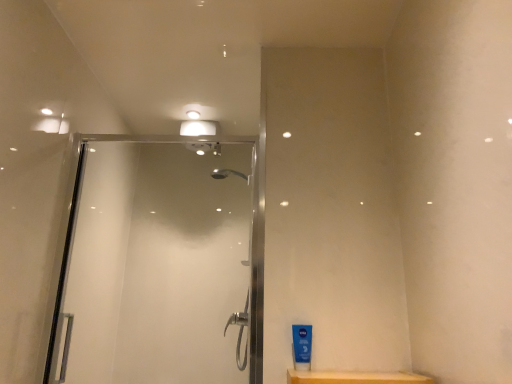
Question: Does clear glass shower door at center lie in front of blue plastic tube at lower right?

Choices:
 (A) yes
 (B) no

Answer: (B)

Question: Is clear glass shower door at center outside of blue plastic tube at lower right?

Choices:
 (A) yes
 (B) no

Answer: (A)

Question: Is clear glass shower door at center taller than blue plastic tube at lower right?

Choices:
 (A) no
 (B) yes

Answer: (B)

Question: Is clear glass shower door at center far from blue plastic tube at lower right?

Choices:
 (A) yes
 (B) no

Answer: (A)

Question: Is clear glass shower door at center facing away from blue plastic tube at lower right?

Choices:
 (A) no
 (B) yes

Answer: (A)

Question: Is the surface of clear glass shower door at center in direct contact with blue plastic tube at lower right?

Choices:
 (A) yes
 (B) no

Answer: (B)

Question: Would you say blue plastic tube at lower right is outside clear glass shower door at center?

Choices:
 (A) no
 (B) yes

Answer: (B)

Question: Can you confirm if blue plastic tube at lower right is taller than clear glass shower door at center?

Choices:
 (A) yes
 (B) no

Answer: (B)

Question: From the image's perspective, is blue plastic tube at lower right below clear glass shower door at center?

Choices:
 (A) no
 (B) yes

Answer: (B)

Question: Does blue plastic tube at lower right have a lesser width compared to clear glass shower door at center?

Choices:
 (A) yes
 (B) no

Answer: (A)

Question: Is blue plastic tube at lower right smaller than clear glass shower door at center?

Choices:
 (A) no
 (B) yes

Answer: (B)

Question: Could you tell me if blue plastic tube at lower right is facing clear glass shower door at center?

Choices:
 (A) yes
 (B) no

Answer: (B)

Question: Considering the relative positions of blue plastic tube at lower right and clear glass shower door at center in the image provided, is blue plastic tube at lower right to the left or to the right of clear glass shower door at center?

Choices:
 (A) right
 (B) left

Answer: (A)